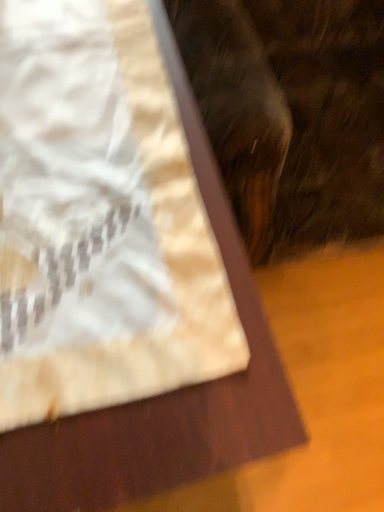
Question: From the image's perspective, is white paper bag at center located beneath fuzzy brown cat at upper right?

Choices:
 (A) yes
 (B) no

Answer: (A)

Question: From the image's perspective, does white paper bag at center appear higher than fuzzy brown cat at upper right?

Choices:
 (A) yes
 (B) no

Answer: (B)

Question: Considering the relative sizes of white paper bag at center and fuzzy brown cat at upper right in the image provided, is white paper bag at center wider than fuzzy brown cat at upper right?

Choices:
 (A) yes
 (B) no

Answer: (A)

Question: Does white paper bag at center appear on the left side of fuzzy brown cat at upper right?

Choices:
 (A) no
 (B) yes

Answer: (B)

Question: Could you tell me if white paper bag at center is turned towards fuzzy brown cat at upper right?

Choices:
 (A) no
 (B) yes

Answer: (A)

Question: Does white paper bag at center come in front of fuzzy brown cat at upper right?

Choices:
 (A) yes
 (B) no

Answer: (B)

Question: Is fuzzy brown cat at upper right bigger than white paper bag at center?

Choices:
 (A) yes
 (B) no

Answer: (A)

Question: Is white paper bag at center inside fuzzy brown cat at upper right?

Choices:
 (A) yes
 (B) no

Answer: (B)

Question: Is fuzzy brown cat at upper right smaller than white paper bag at center?

Choices:
 (A) no
 (B) yes

Answer: (A)

Question: From a real-world perspective, is fuzzy brown cat at upper right located beneath white paper bag at center?

Choices:
 (A) no
 (B) yes

Answer: (A)

Question: Is the surface of fuzzy brown cat at upper right in direct contact with white paper bag at center?

Choices:
 (A) yes
 (B) no

Answer: (B)

Question: Does fuzzy brown cat at upper right have a greater width compared to white paper bag at center?

Choices:
 (A) yes
 (B) no

Answer: (B)

Question: From a real-world perspective, relative to fuzzy brown cat at upper right, is white paper bag at center vertically above or below?

Choices:
 (A) above
 (B) below

Answer: (B)